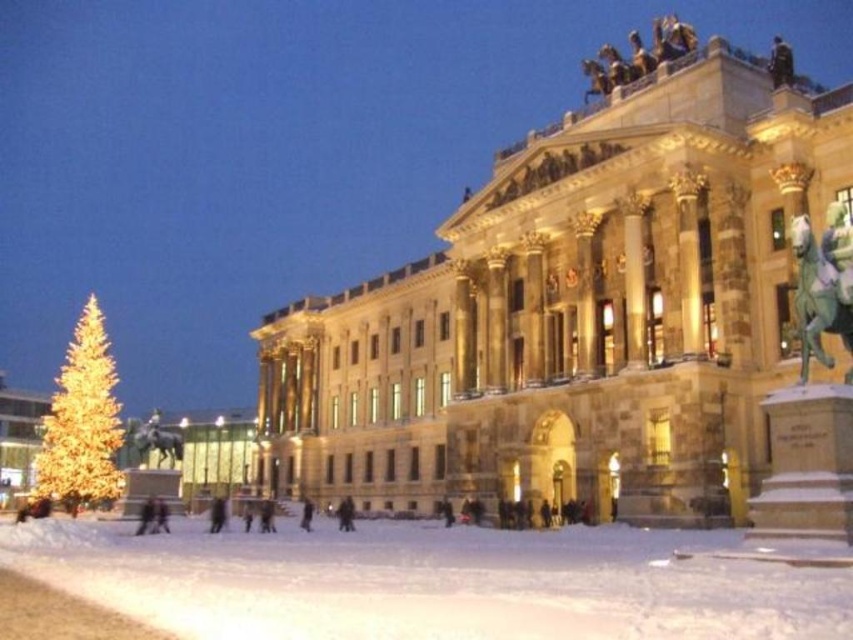
Which is above, white powdery snow at lower center or green patina bronze horse at upper right?

green patina bronze horse at upper right

Which of these two, white powdery snow at lower center or green patina bronze horse at upper right, stands taller?

With more height is green patina bronze horse at upper right.

Image resolution: width=853 pixels, height=640 pixels. What are the coordinates of `white powdery snow at lower center` in the screenshot? It's located at (434, 582).

Measure the distance between polished bronze statue at lower left and dark brown fur coat at center.

28.82 meters

Where is `polished bronze statue at lower left`? The width and height of the screenshot is (853, 640). polished bronze statue at lower left is located at coordinates (155, 440).

Does point (465, 308) come in front of point (97, 353)?

Yes, it is.

Is point (663, 120) closer to camera compared to point (90, 484)?

Yes, it is.

Locate an element on the screen. stone/brick palace at center is located at coordinates (573, 314).